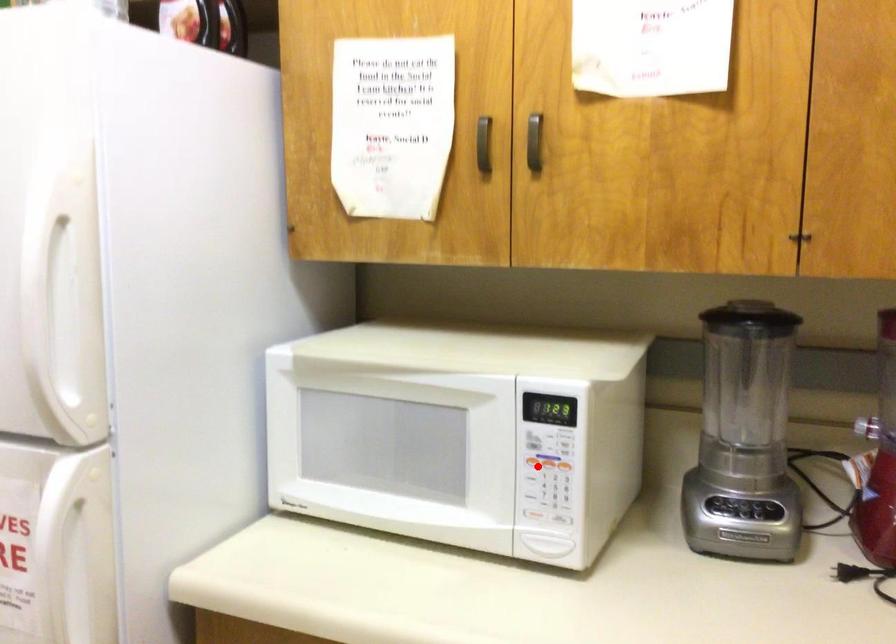
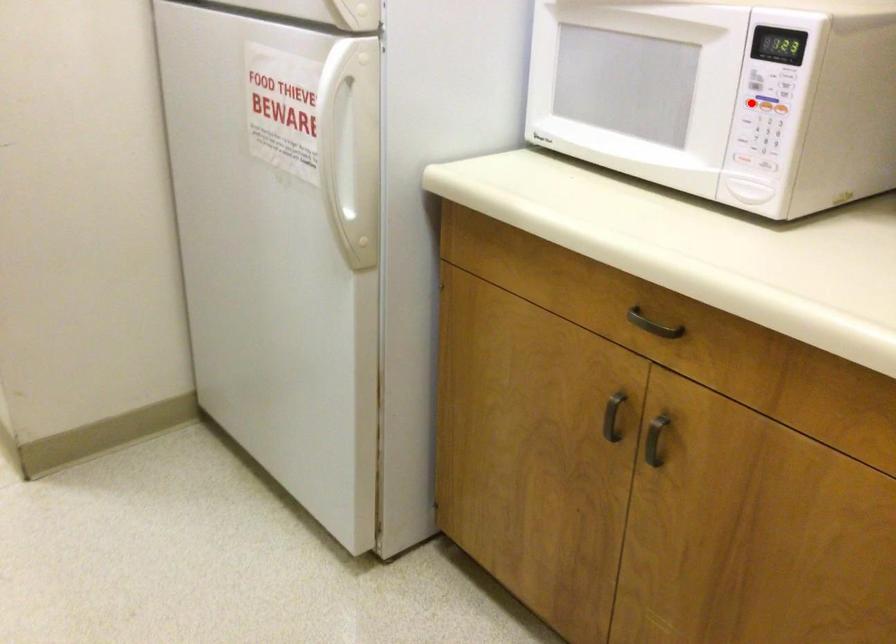
I am providing you with two images of the same scene from different viewpoints. A red point is marked on the first image and another point is marked on the second image. Does the point marked in image1 correspond to the same location as the one in image2?

Yes